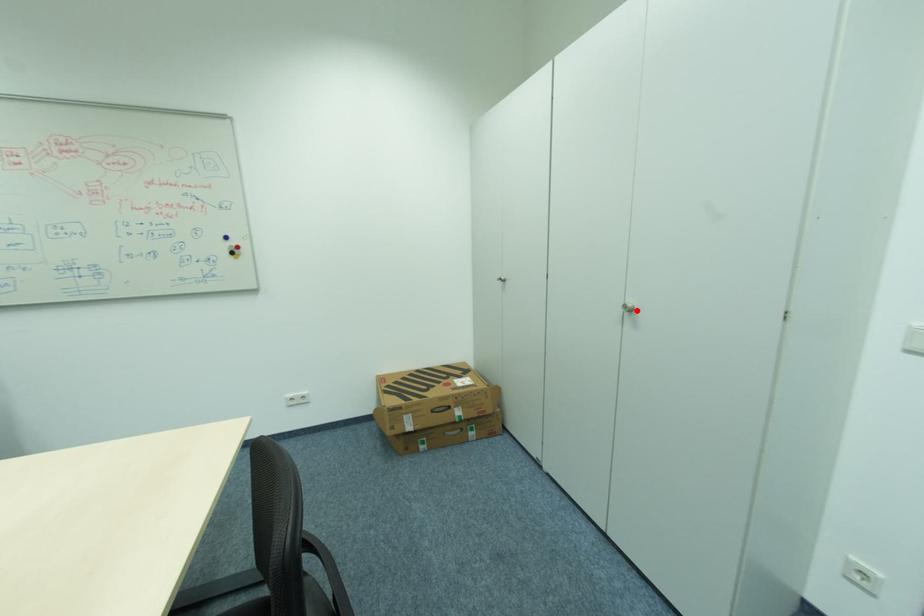
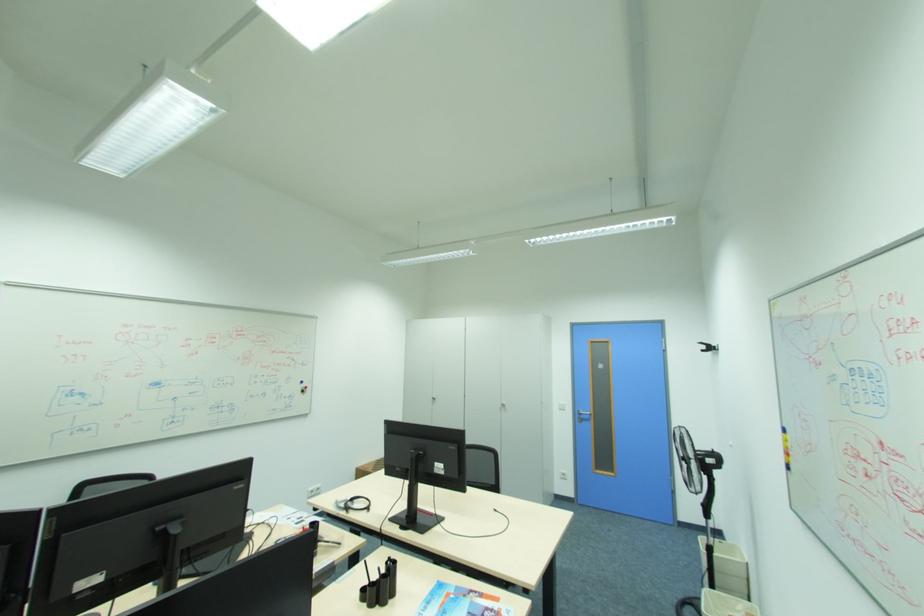
Find the pixel in the second image that matches the highlighted location in the first image.

(508, 406)